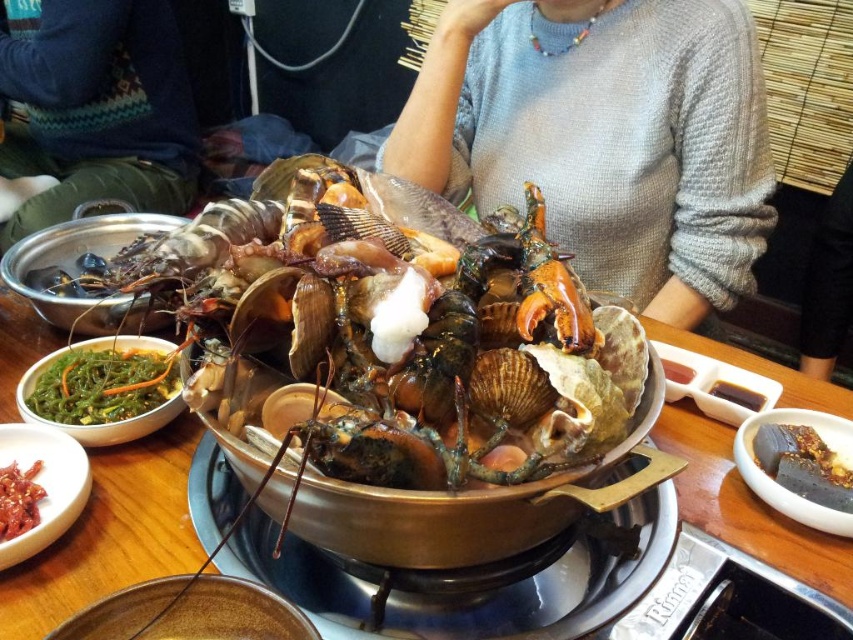
Question: Can you confirm if gray knitted sweater at upper center is positioned to the left of shiny red sauce at lower left?

Choices:
 (A) no
 (B) yes

Answer: (A)

Question: Which object is farther from the camera taking this photo?

Choices:
 (A) purple matte jelly at lower right
 (B) blue sweater at upper center

Answer: (B)

Question: Among these points, which one is nearest to the camera?

Choices:
 (A) click(x=61, y=148)
 (B) click(x=582, y=240)
 (C) click(x=28, y=500)
 (D) click(x=131, y=365)

Answer: (C)

Question: Can you confirm if blue sweater at upper center is wider than purple matte jelly at lower right?

Choices:
 (A) no
 (B) yes

Answer: (B)

Question: Which of the following is the closest to the observer?

Choices:
 (A) shiny red sauce at lower left
 (B) purple matte jelly at lower right
 (C) blue sweater at upper center

Answer: (A)

Question: Is blue sweater at upper center below white glossy rice at center?

Choices:
 (A) yes
 (B) no

Answer: (B)